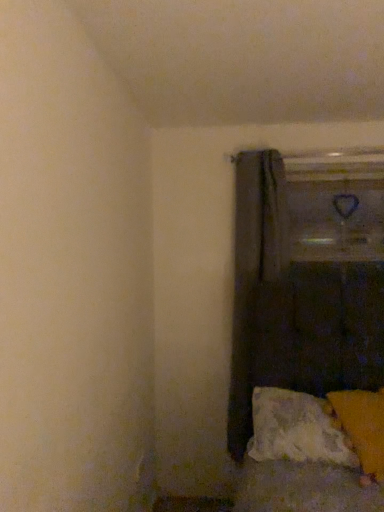
Image resolution: width=384 pixels, height=512 pixels. What are the coordinates of `orange fabric pillow at lower right, acting as the 2th pillow starting from the left` in the screenshot? It's located at (362, 426).

Find the location of a particular element. This screenshot has width=384, height=512. dark gray fabric curtain at center is located at coordinates (258, 288).

Between orange fabric pillow at lower right, which appears as the first pillow when viewed from the right, and dark gray fabric curtain at center, which one has more height?

With more height is dark gray fabric curtain at center.

Looking at this image, is orange fabric pillow at lower right, which appears as the first pillow when viewed from the right, oriented towards dark gray fabric curtain at center?

No.

In terms of size, does orange fabric pillow at lower right, acting as the 2th pillow starting from the left, appear bigger or smaller than dark gray fabric curtain at center?

Clearly, orange fabric pillow at lower right, acting as the 2th pillow starting from the left, is smaller in size than dark gray fabric curtain at center.

From the image's perspective, is orange fabric pillow at lower right, which appears as the first pillow when viewed from the right, located above or below dark gray fabric curtain at center?

orange fabric pillow at lower right, which appears as the first pillow when viewed from the right, is below dark gray fabric curtain at center.

How many degrees apart are the facing directions of dark gray fabric curtain at center and orange fabric pillow at lower right, which appears as the first pillow when viewed from the right?

The angular difference between dark gray fabric curtain at center and orange fabric pillow at lower right, which appears as the first pillow when viewed from the right, is 15.5 degrees.

Relative to orange fabric pillow at lower right, acting as the 2th pillow starting from the left, is dark gray fabric curtain at center in front or behind?

Visually, dark gray fabric curtain at center is located behind orange fabric pillow at lower right, acting as the 2th pillow starting from the left.

Can you confirm if dark gray fabric curtain at center is positioned to the right of orange fabric pillow at lower right, which appears as the first pillow when viewed from the right?

In fact, dark gray fabric curtain at center is to the left of orange fabric pillow at lower right, which appears as the first pillow when viewed from the right.

Is dark gray fabric curtain at center looking in the opposite direction of textured white pillow at lower right, the first pillow positioned from the left?

No, dark gray fabric curtain at center is not facing the opposite direction of textured white pillow at lower right, the first pillow positioned from the left.

Relative to textured white pillow at lower right, the first pillow positioned from the left, is dark gray fabric curtain at center in front or behind?

In the image, dark gray fabric curtain at center appears behind textured white pillow at lower right, the first pillow positioned from the left.

Is dark gray fabric curtain at center spatially inside textured white pillow at lower right, the first pillow positioned from the left, or outside of it?

dark gray fabric curtain at center is not inside textured white pillow at lower right, the first pillow positioned from the left, it's outside.

Considering the positions of points (361, 400) and (296, 435), is point (361, 400) farther from camera compared to point (296, 435)?

Yes, point (361, 400) is behind point (296, 435).

Looking at their sizes, would you say orange fabric pillow at lower right, which appears as the first pillow when viewed from the right, is wider or thinner than textured white pillow at lower right, which ranks as the second pillow in right-to-left order?

Considering their sizes, orange fabric pillow at lower right, which appears as the first pillow when viewed from the right, looks broader than textured white pillow at lower right, which ranks as the second pillow in right-to-left order.

Considering the positions of objects orange fabric pillow at lower right, which appears as the first pillow when viewed from the right, and textured white pillow at lower right, which ranks as the second pillow in right-to-left order, in the image provided, who is more to the left, orange fabric pillow at lower right, which appears as the first pillow when viewed from the right, or textured white pillow at lower right, which ranks as the second pillow in right-to-left order,?

From the viewer's perspective, textured white pillow at lower right, which ranks as the second pillow in right-to-left order, appears more on the left side.

Image resolution: width=384 pixels, height=512 pixels. Identify the location of pillow below the orange fabric pillow at lower right, which appears as the first pillow when viewed from the right (from the image's perspective). (297, 429).

What's the angular difference between textured white pillow at lower right, which ranks as the second pillow in right-to-left order, and dark gray fabric curtain at center's facing directions?

textured white pillow at lower right, which ranks as the second pillow in right-to-left order, and dark gray fabric curtain at center are facing 2.07 degrees away from each other.

From the image's perspective, which one is positioned lower, textured white pillow at lower right, the first pillow positioned from the left, or dark gray fabric curtain at center?

textured white pillow at lower right, the first pillow positioned from the left, appears lower in the image.

In the image, is textured white pillow at lower right, which ranks as the second pillow in right-to-left order, positioned in front of or behind dark gray fabric curtain at center?

textured white pillow at lower right, which ranks as the second pillow in right-to-left order, is in front of dark gray fabric curtain at center.

Measure the distance between textured white pillow at lower right, which ranks as the second pillow in right-to-left order, and dark gray fabric curtain at center.

textured white pillow at lower right, which ranks as the second pillow in right-to-left order, and dark gray fabric curtain at center are 15.82 inches apart.

Are textured white pillow at lower right, the first pillow positioned from the left, and orange fabric pillow at lower right, which appears as the first pillow when viewed from the right, far apart?

textured white pillow at lower right, the first pillow positioned from the left, is near orange fabric pillow at lower right, which appears as the first pillow when viewed from the right, not far away.

Which is more to the right, textured white pillow at lower right, the first pillow positioned from the left, or orange fabric pillow at lower right, which appears as the first pillow when viewed from the right?

orange fabric pillow at lower right, which appears as the first pillow when viewed from the right.

Considering their positions, is textured white pillow at lower right, which ranks as the second pillow in right-to-left order, located in front of or behind orange fabric pillow at lower right, acting as the 2th pillow starting from the left?

Clearly, textured white pillow at lower right, which ranks as the second pillow in right-to-left order, is behind orange fabric pillow at lower right, acting as the 2th pillow starting from the left.

From the image's perspective, which is below, textured white pillow at lower right, the first pillow positioned from the left, or orange fabric pillow at lower right, which appears as the first pillow when viewed from the right?

textured white pillow at lower right, the first pillow positioned from the left, appears lower in the image.

The width and height of the screenshot is (384, 512). Find the location of `the 2nd pillow counting from the right side of the dark gray fabric curtain at center`. the 2nd pillow counting from the right side of the dark gray fabric curtain at center is located at coordinates (362, 426).

You are a GUI agent. You are given a task and a screenshot of the screen. Output one action in this format:
    pyautogui.click(x=<x>, y=<y>)
    Task: Click on the curtain on the left of orange fabric pillow at lower right, which appears as the first pillow when viewed from the right
    
    Given the screenshot: What is the action you would take?
    (258, 288)

From the picture: When comparing their distances from orange fabric pillow at lower right, which appears as the first pillow when viewed from the right, does textured white pillow at lower right, the first pillow positioned from the left, or dark gray fabric curtain at center seem closer?

Based on the image, textured white pillow at lower right, the first pillow positioned from the left, appears to be nearer to orange fabric pillow at lower right, which appears as the first pillow when viewed from the right.

When comparing their distances from textured white pillow at lower right, which ranks as the second pillow in right-to-left order, does orange fabric pillow at lower right, acting as the 2th pillow starting from the left, or dark gray fabric curtain at center seem closer?

Among the two, orange fabric pillow at lower right, acting as the 2th pillow starting from the left, is located nearer to textured white pillow at lower right, which ranks as the second pillow in right-to-left order.

Estimate the real-world distances between objects in this image. Which object is closer to dark gray fabric curtain at center, textured white pillow at lower right, the first pillow positioned from the left, or orange fabric pillow at lower right, acting as the 2th pillow starting from the left?

textured white pillow at lower right, the first pillow positioned from the left, lies closer to dark gray fabric curtain at center than the other object.

Estimate the real-world distances between objects in this image. Which object is closer to textured white pillow at lower right, which ranks as the second pillow in right-to-left order, dark gray fabric curtain at center or orange fabric pillow at lower right, which appears as the first pillow when viewed from the right?

orange fabric pillow at lower right, which appears as the first pillow when viewed from the right, lies closer to textured white pillow at lower right, which ranks as the second pillow in right-to-left order, than the other object.

When comparing their distances from orange fabric pillow at lower right, which appears as the first pillow when viewed from the right, does dark gray fabric curtain at center or textured white pillow at lower right, the first pillow positioned from the left, seem closer?

Among the two, textured white pillow at lower right, the first pillow positioned from the left, is located nearer to orange fabric pillow at lower right, which appears as the first pillow when viewed from the right.

Consider the image. Which object lies nearer to the anchor point dark gray fabric curtain at center, orange fabric pillow at lower right, acting as the 2th pillow starting from the left, or textured white pillow at lower right, which ranks as the second pillow in right-to-left order?

textured white pillow at lower right, which ranks as the second pillow in right-to-left order, is closer to dark gray fabric curtain at center.

Identify the location of pillow positioned between orange fabric pillow at lower right, which appears as the first pillow when viewed from the right, and dark gray fabric curtain at center from near to far. (297, 429).